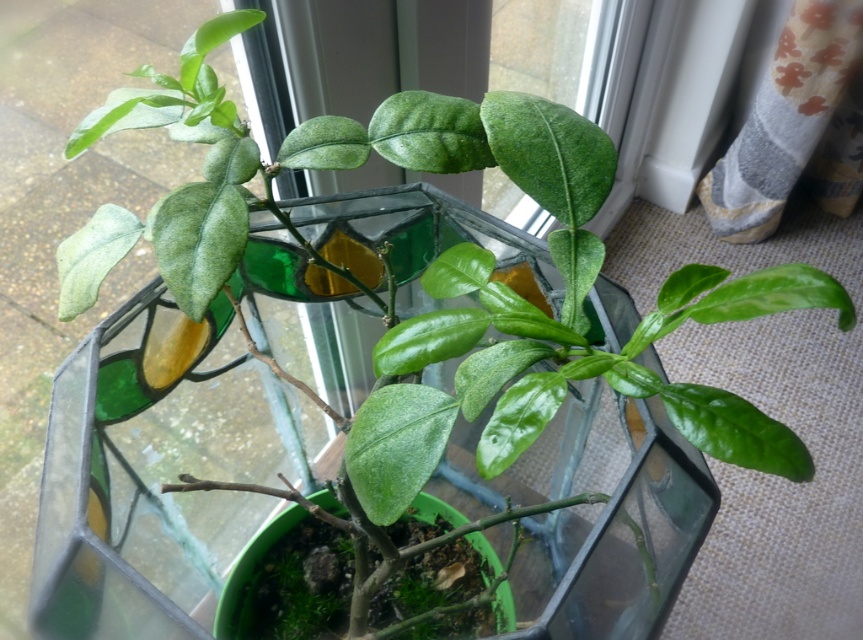
Does green stained glass at center lie in front of green glossy leaves at center?

No.

Which is in front, point (96, 392) or point (378, 404)?

Point (378, 404)

Measure the distance between point (184, 548) and camera.

Point (184, 548) is 31.74 inches from camera.

Where is `green stained glass at center`? The image size is (863, 640). green stained glass at center is located at coordinates (158, 481).

Is green glossy leaves at center wider than green matte glass vase at center?

Yes.

Does green glossy leaves at center appear on the right side of green matte glass vase at center?

Yes, green glossy leaves at center is to the right of green matte glass vase at center.

Which is behind, point (518, 440) or point (249, 552)?

The point (249, 552) is behind.

The height and width of the screenshot is (640, 863). I want to click on green glossy leaves at center, so click(x=438, y=268).

Looking at this image, is green stained glass at center behind green matte glass vase at center?

That is False.

Is point (74, 598) positioned behind point (250, 550)?

No, (74, 598) is in front of (250, 550).

Identify the location of green stained glass at center. (158, 481).